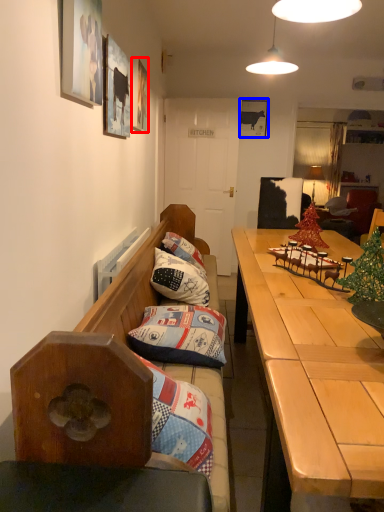
Question: Which of the following is the farthest to the observer, picture frame (highlighted by a red box) or picture frame (highlighted by a blue box)?

Choices:
 (A) picture frame
 (B) picture frame

Answer: (B)